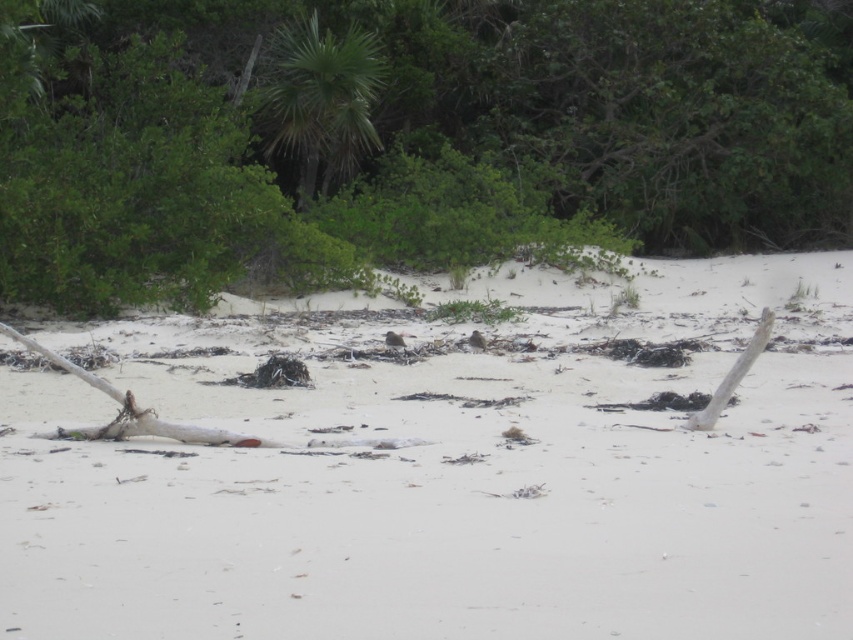
Between green leafy tree at upper center and green leafy palm tree at upper center, which one is positioned lower?

green leafy tree at upper center

Does green leafy tree at upper center have a greater width compared to green leafy palm tree at upper center?

Correct, the width of green leafy tree at upper center exceeds that of green leafy palm tree at upper center.

You are a GUI agent. You are given a task and a screenshot of the screen. Output one action in this format:
    pyautogui.click(x=<x>, y=<y>)
    Task: Click on the green leafy tree at upper center
    Image resolution: width=853 pixels, height=640 pixels.
    Given the screenshot: What is the action you would take?
    pyautogui.click(x=405, y=138)

Consider the image. Is white sandy beach at center positioned in front of green leafy palm tree at upper center?

Yes, white sandy beach at center is closer to the viewer.

Does point (229, 556) come farther from viewer compared to point (303, 115)?

No, it is in front of (303, 115).

Is point (670, 484) positioned before point (345, 172)?

Yes, point (670, 484) is closer to viewer.

You are a GUI agent. You are given a task and a screenshot of the screen. Output one action in this format:
    pyautogui.click(x=<x>, y=<y>)
    Task: Click on the white sandy beach at center
    This screenshot has width=853, height=640.
    Given the screenshot: What is the action you would take?
    pyautogui.click(x=432, y=502)

Is white sandy beach at center thinner than green leafy tree at upper center?

Correct, white sandy beach at center's width is less than green leafy tree at upper center's.

Can you confirm if white sandy beach at center is smaller than green leafy tree at upper center?

Indeed, white sandy beach at center has a smaller size compared to green leafy tree at upper center.

Find the location of a particular element. The height and width of the screenshot is (640, 853). white sandy beach at center is located at coordinates (432, 502).

Identify the location of white sandy beach at center. The height and width of the screenshot is (640, 853). (432, 502).